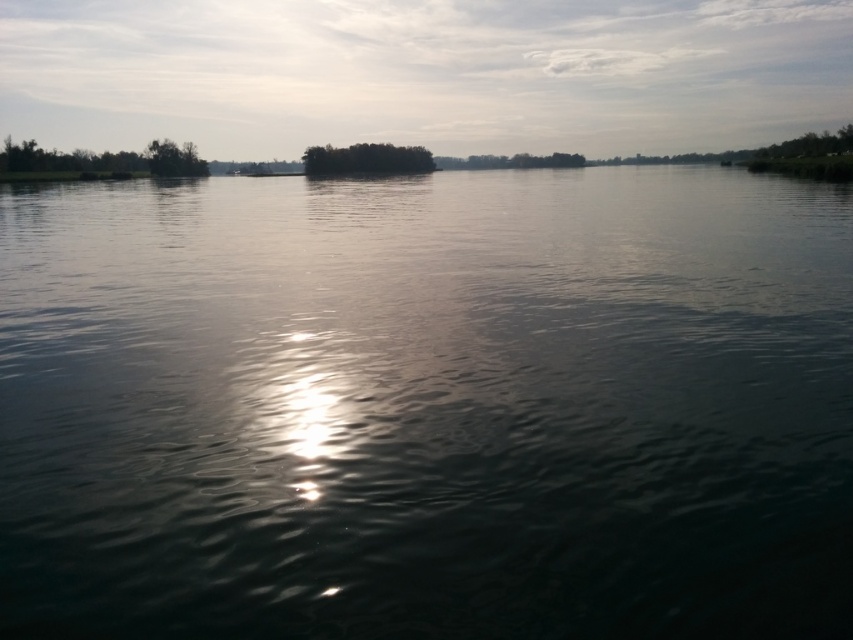
Is greenish reflective water at center below green leafy trees at left?

Yes, greenish reflective water at center is below green leafy trees at left.

Based on the photo, which of these two, greenish reflective water at center or green leafy trees at left, stands taller?

green leafy trees at left is taller.

Consider the image. Who is more forward, [827,499] or [155,148]?

Point [827,499] is in front.

In order to click on greenish reflective water at center in this screenshot , I will do click(427, 406).

Is green leafy trees at left below green leafy island at center?

Incorrect, green leafy trees at left is not positioned below green leafy island at center.

Can you confirm if green leafy trees at left is positioned to the right of green leafy island at center?

No, green leafy trees at left is not to the right of green leafy island at center.

Between point (148, 170) and point (410, 161), which one is positioned in front?

Point (148, 170)

The width and height of the screenshot is (853, 640). Find the location of `green leafy trees at left`. green leafy trees at left is located at coordinates (105, 160).

Is green leafy island at center to the left of green matte tree at upper left from the viewer's perspective?

In fact, green leafy island at center is to the right of green matte tree at upper left.

Does point (305, 150) come in front of point (184, 154)?

No.

At what (x,y) coordinates should I click in order to perform the action: click on green leafy island at center. Please return your answer as a coordinate pair (x, y). This screenshot has height=640, width=853. Looking at the image, I should click on (366, 160).